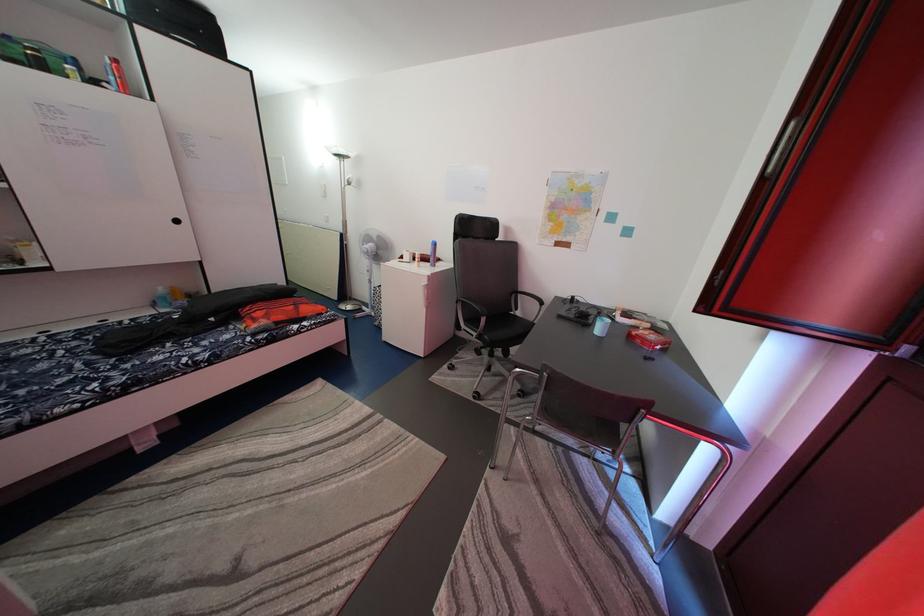
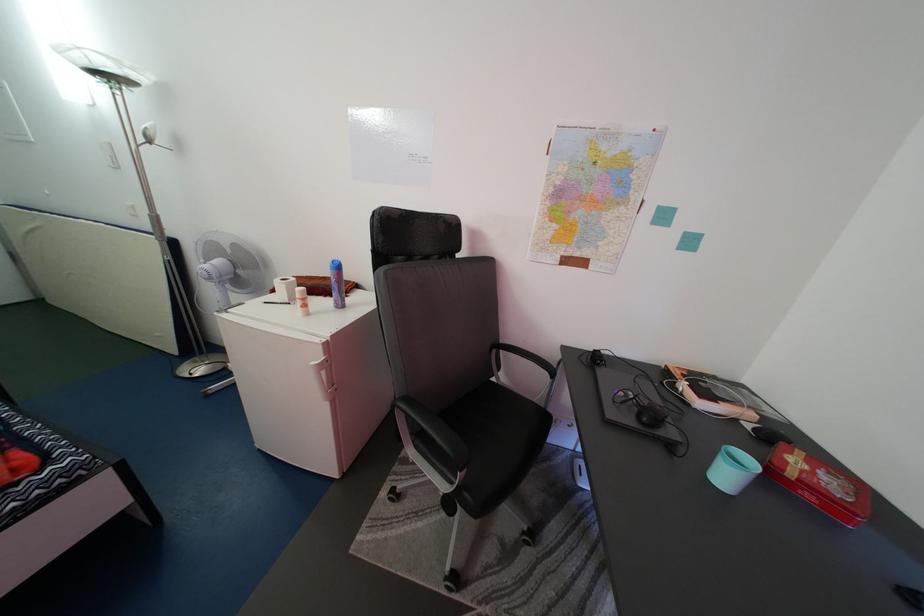
Question: Which direction would the cameraman need to move to produce the second image? Reply with the corresponding letter.

Choices:
 (A) Left
 (B) Right
 (C) Forward
 (D) Backward

Answer: (C)